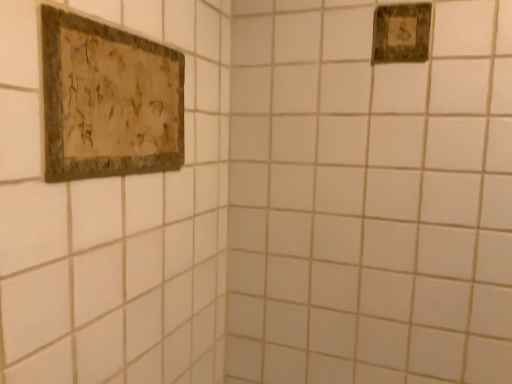
Locate an element on the screen. rustic wood sign at upper right, placed as the 2th picture frame when sorted from left to right is located at coordinates (401, 33).

What do you see at coordinates (401, 33) in the screenshot? The height and width of the screenshot is (384, 512). I see `rustic wood sign at upper right, which is counted as the first picture frame, starting from the back` at bounding box center [401, 33].

Find the location of `rustic wood picture frame at upper left, the 2th picture frame in the back-to-front sequence`. rustic wood picture frame at upper left, the 2th picture frame in the back-to-front sequence is located at coordinates (108, 100).

What do you see at coordinates (108, 100) in the screenshot? I see `rustic wood picture frame at upper left, the 1th picture frame from the front` at bounding box center [108, 100].

Where is `rustic wood sign at upper right, which is the 2th picture frame from front to back`? rustic wood sign at upper right, which is the 2th picture frame from front to back is located at coordinates (401, 33).

Considering the positions of objects rustic wood sign at upper right, positioned as the 1th picture frame in top-to-bottom order, and rustic wood picture frame at upper left, which is the 1th picture frame in bottom-to-top order, in the image provided, who is more to the right, rustic wood sign at upper right, positioned as the 1th picture frame in top-to-bottom order, or rustic wood picture frame at upper left, which is the 1th picture frame in bottom-to-top order,?

Positioned to the right is rustic wood sign at upper right, positioned as the 1th picture frame in top-to-bottom order.

Between rustic wood sign at upper right, which is counted as the first picture frame, starting from the back, and rustic wood picture frame at upper left, the 1th picture frame from the left, which one is positioned behind?

rustic wood sign at upper right, which is counted as the first picture frame, starting from the back, is more distant.

Which is closer to the camera, (398, 21) or (174, 164)?

Point (174, 164)

From the image's perspective, is rustic wood sign at upper right, which is the 2th picture frame from front to back, below rustic wood picture frame at upper left, the 1th picture frame from the front?

Actually, rustic wood sign at upper right, which is the 2th picture frame from front to back, appears above rustic wood picture frame at upper left, the 1th picture frame from the front, in the image.

From a real-world perspective, is rustic wood sign at upper right, acting as the 1th picture frame starting from the right, positioned above or below rustic wood picture frame at upper left, the 2th picture frame in the back-to-front sequence?

Clearly, from a real-world perspective, rustic wood sign at upper right, acting as the 1th picture frame starting from the right, is above rustic wood picture frame at upper left, the 2th picture frame in the back-to-front sequence.

Which of these two, rustic wood sign at upper right, which is the 2th picture frame from front to back, or rustic wood picture frame at upper left, the 1th picture frame from the left, is thinner?

rustic wood sign at upper right, which is the 2th picture frame from front to back, is thinner.

Who is taller, rustic wood sign at upper right, which is counted as the first picture frame, starting from the back, or rustic wood picture frame at upper left, the 1th picture frame from the left?

Standing taller between the two is rustic wood picture frame at upper left, the 1th picture frame from the left.

Can you confirm if rustic wood sign at upper right, positioned as the 1th picture frame in top-to-bottom order, is smaller than rustic wood picture frame at upper left, the 1th picture frame from the front?

Correct, rustic wood sign at upper right, positioned as the 1th picture frame in top-to-bottom order, occupies less space than rustic wood picture frame at upper left, the 1th picture frame from the front.

Could rustic wood picture frame at upper left, the 1th picture frame from the left, be considered to be inside rustic wood sign at upper right, acting as the 1th picture frame starting from the right?

Actually, rustic wood picture frame at upper left, the 1th picture frame from the left, is outside rustic wood sign at upper right, acting as the 1th picture frame starting from the right.

In the scene shown: Is rustic wood sign at upper right, the 2th picture frame when ordered from bottom to top, touching rustic wood picture frame at upper left, the 2th picture frame in the back-to-front sequence?

No, rustic wood sign at upper right, the 2th picture frame when ordered from bottom to top, is not in contact with rustic wood picture frame at upper left, the 2th picture frame in the back-to-front sequence.

Could you tell me if rustic wood sign at upper right, which is the 2th picture frame from front to back, is turned towards rustic wood picture frame at upper left, acting as the second picture frame starting from the right?

No.

Can you tell me how much rustic wood sign at upper right, positioned as the 1th picture frame in top-to-bottom order, and rustic wood picture frame at upper left, which is the 1th picture frame in bottom-to-top order, differ in facing direction?

90 degrees.

How much distance is there between rustic wood sign at upper right, which is counted as the first picture frame, starting from the back, and rustic wood picture frame at upper left, which is the second picture frame from top to bottom?

rustic wood sign at upper right, which is counted as the first picture frame, starting from the back, is 19.38 inches from rustic wood picture frame at upper left, which is the second picture frame from top to bottom.

You are a GUI agent. You are given a task and a screenshot of the screen. Output one action in this format:
    pyautogui.click(x=<x>, y=<y>)
    Task: Click on the picture frame that appears above the rustic wood picture frame at upper left, the 2th picture frame in the back-to-front sequence (from the image's perspective)
    The width and height of the screenshot is (512, 384).
    Given the screenshot: What is the action you would take?
    pyautogui.click(x=401, y=33)

Considering the positions of objects rustic wood picture frame at upper left, the 2th picture frame in the back-to-front sequence, and rustic wood sign at upper right, the 2th picture frame when ordered from bottom to top, in the image provided, who is more to the left, rustic wood picture frame at upper left, the 2th picture frame in the back-to-front sequence, or rustic wood sign at upper right, the 2th picture frame when ordered from bottom to top,?

From the viewer's perspective, rustic wood picture frame at upper left, the 2th picture frame in the back-to-front sequence, appears more on the left side.

Does rustic wood picture frame at upper left, which is the second picture frame from top to bottom, lie behind rustic wood sign at upper right, which is counted as the first picture frame, starting from the back?

No.

Considering the points (72, 98) and (381, 53), which point is in front, point (72, 98) or point (381, 53)?

The point (72, 98) is in front.

From the image's perspective, which object appears higher, rustic wood picture frame at upper left, the 1th picture frame from the left, or rustic wood sign at upper right, placed as the 2th picture frame when sorted from left to right?

rustic wood sign at upper right, placed as the 2th picture frame when sorted from left to right, is shown above in the image.

From a real-world perspective, relative to rustic wood sign at upper right, acting as the 1th picture frame starting from the right, is rustic wood picture frame at upper left, acting as the second picture frame starting from the right, vertically above or below?

rustic wood picture frame at upper left, acting as the second picture frame starting from the right, is below rustic wood sign at upper right, acting as the 1th picture frame starting from the right.

Does rustic wood picture frame at upper left, which is the second picture frame from top to bottom, have a greater width compared to rustic wood sign at upper right, which is counted as the first picture frame, starting from the back?

Yes.

Considering the sizes of objects rustic wood picture frame at upper left, the 1th picture frame from the left, and rustic wood sign at upper right, the 2th picture frame when ordered from bottom to top, in the image provided, who is taller, rustic wood picture frame at upper left, the 1th picture frame from the left, or rustic wood sign at upper right, the 2th picture frame when ordered from bottom to top,?

With more height is rustic wood picture frame at upper left, the 1th picture frame from the left.

Between rustic wood picture frame at upper left, which is the second picture frame from top to bottom, and rustic wood sign at upper right, acting as the 1th picture frame starting from the right, which one has larger size?

With larger size is rustic wood picture frame at upper left, which is the second picture frame from top to bottom.

Which is correct: rustic wood picture frame at upper left, the 1th picture frame from the left, is inside rustic wood sign at upper right, placed as the 2th picture frame when sorted from left to right, or outside of it?

rustic wood picture frame at upper left, the 1th picture frame from the left, exists outside the volume of rustic wood sign at upper right, placed as the 2th picture frame when sorted from left to right.

Is the surface of rustic wood picture frame at upper left, which is the 1th picture frame in bottom-to-top order, in direct contact with rustic wood sign at upper right, which is the 2th picture frame from front to back?

No.

Does rustic wood picture frame at upper left, the 1th picture frame from the front, turn towards rustic wood sign at upper right, acting as the 1th picture frame starting from the right?

No, rustic wood picture frame at upper left, the 1th picture frame from the front, is not turned towards rustic wood sign at upper right, acting as the 1th picture frame starting from the right.

How many degrees apart are the facing directions of rustic wood picture frame at upper left, which is the 1th picture frame in bottom-to-top order, and rustic wood sign at upper right, which is the 2th picture frame from front to back?

rustic wood picture frame at upper left, which is the 1th picture frame in bottom-to-top order, and rustic wood sign at upper right, which is the 2th picture frame from front to back, are facing 90 degrees away from each other.

Find the location of a particular element. Image resolution: width=512 pixels, height=384 pixels. picture frame below the rustic wood sign at upper right, placed as the 2th picture frame when sorted from left to right (from the image's perspective) is located at coordinates (108, 100).

You are a GUI agent. You are given a task and a screenshot of the screen. Output one action in this format:
    pyautogui.click(x=<x>, y=<y>)
    Task: Click on the picture frame above the rustic wood picture frame at upper left, the 1th picture frame from the front (from a real-world perspective)
    The image size is (512, 384).
    Given the screenshot: What is the action you would take?
    pyautogui.click(x=401, y=33)

Image resolution: width=512 pixels, height=384 pixels. I want to click on picture frame on the left of rustic wood sign at upper right, which is the 2th picture frame from front to back, so click(x=108, y=100).